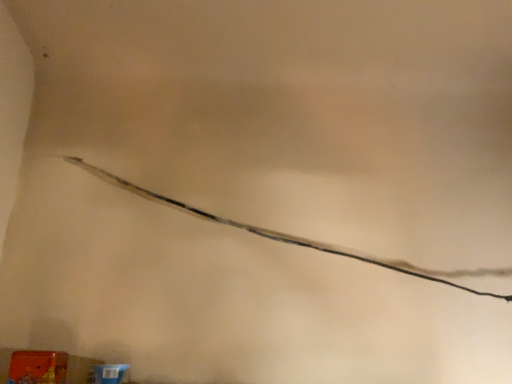
What do you see at coordinates (38, 367) in the screenshot? I see `matte orange toy at lower left` at bounding box center [38, 367].

Find the location of a particular element. The image size is (512, 384). matte orange toy at lower left is located at coordinates (38, 367).

What are the coordinates of `matte orange toy at lower left` in the screenshot? It's located at (38, 367).